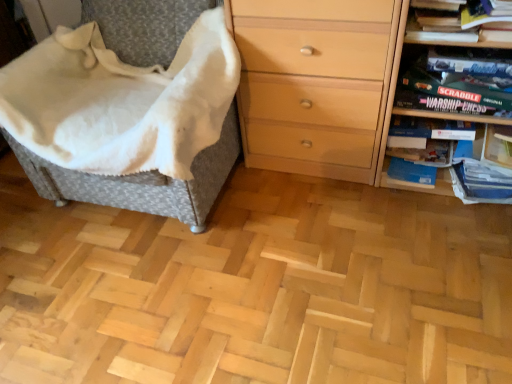
Question: Considering the relative sizes of light wood chest of drawers at right and woven fabric chair at left in the image provided, is light wood chest of drawers at right shorter than woven fabric chair at left?

Choices:
 (A) no
 (B) yes

Answer: (B)

Question: Is light wood chest of drawers at right directly adjacent to woven fabric chair at left?

Choices:
 (A) no
 (B) yes

Answer: (A)

Question: Does light wood chest of drawers at right appear on the right side of woven fabric chair at left?

Choices:
 (A) yes
 (B) no

Answer: (A)

Question: From a real-world perspective, is light wood chest of drawers at right physically above woven fabric chair at left?

Choices:
 (A) yes
 (B) no

Answer: (B)

Question: Is light wood chest of drawers at right positioned behind woven fabric chair at left?

Choices:
 (A) yes
 (B) no

Answer: (A)

Question: In terms of width, does matte black game box at upper right look wider or thinner when compared to hardcover book at upper right?

Choices:
 (A) wide
 (B) thin

Answer: (A)

Question: Considering the positions of matte black game box at upper right and hardcover book at upper right in the image, is matte black game box at upper right taller or shorter than hardcover book at upper right?

Choices:
 (A) tall
 (B) short

Answer: (A)

Question: From the image's perspective, relative to hardcover book at upper right, is matte black game box at upper right above or below?

Choices:
 (A) above
 (B) below

Answer: (B)

Question: Is matte black game box at upper right situated inside hardcover book at upper right or outside?

Choices:
 (A) inside
 (B) outside

Answer: (B)

Question: From a real-world perspective, is hardcover book at upper right physically located above or below matte black game box at upper right?

Choices:
 (A) below
 (B) above

Answer: (B)

Question: Would you say hardcover book at upper right is inside or outside matte black game box at upper right?

Choices:
 (A) outside
 (B) inside

Answer: (A)

Question: From their relative heights in the image, would you say hardcover book at upper right is taller or shorter than matte black game box at upper right?

Choices:
 (A) short
 (B) tall

Answer: (A)

Question: Is hardcover book at upper right wider or thinner than matte black game box at upper right?

Choices:
 (A) thin
 (B) wide

Answer: (A)

Question: From the image's perspective, is woven fabric chair at left above or below matte black game box at upper right?

Choices:
 (A) below
 (B) above

Answer: (B)

Question: In terms of height, does woven fabric chair at left look taller or shorter compared to matte black game box at upper right?

Choices:
 (A) short
 (B) tall

Answer: (B)